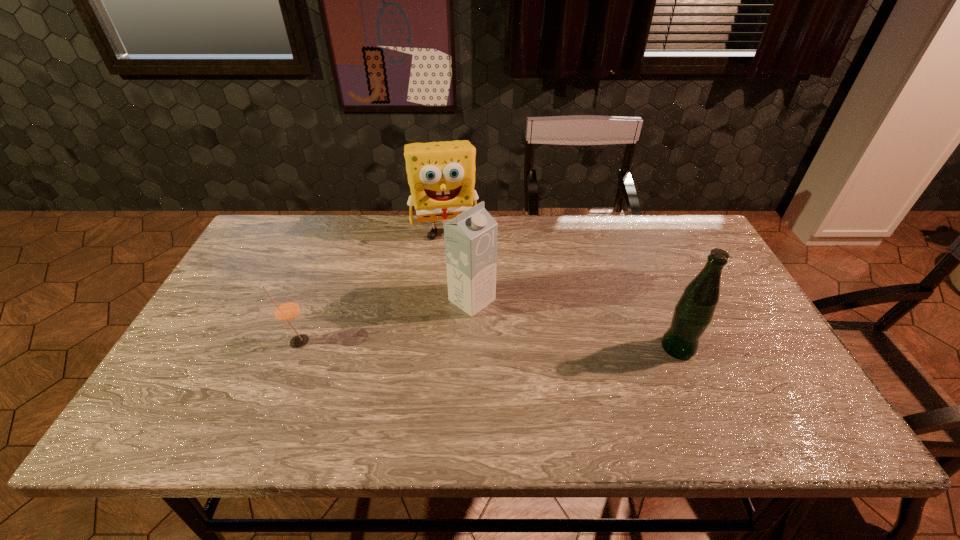
This screenshot has height=540, width=960. I want to click on free space that is in between the straw and the carton, so click(385, 321).

Where is `empty space that is in between the shortest object and the second farthest object`? This screenshot has height=540, width=960. empty space that is in between the shortest object and the second farthest object is located at coordinates (385, 321).

Identify the location of empty location between the second farthest object and the beer bottle. The image size is (960, 540). (575, 324).

The height and width of the screenshot is (540, 960). What are the coordinates of `vacant space in between the rightmost object and the shortest object` in the screenshot? It's located at (488, 345).

The width and height of the screenshot is (960, 540). What are the coordinates of `vacant area between the shortest object and the third nearest object` in the screenshot? It's located at (385, 321).

You are a GUI agent. You are given a task and a screenshot of the screen. Output one action in this format:
    pyautogui.click(x=<x>, y=<y>)
    Task: Click on the empty location between the beer bottle and the sponge
    
    Given the screenshot: What is the action you would take?
    pyautogui.click(x=562, y=289)

This screenshot has width=960, height=540. In order to click on object that can be found as the third closest to the sponge in this screenshot , I will do [x=693, y=313].

Where is `object identified as the closest to the sponge`? This screenshot has width=960, height=540. object identified as the closest to the sponge is located at coordinates (471, 237).

This screenshot has width=960, height=540. I want to click on free spot that satisfies the following two spatial constraints: 1. on the back side of the leftmost object; 2. on the right side of the third nearest object, so click(x=314, y=300).